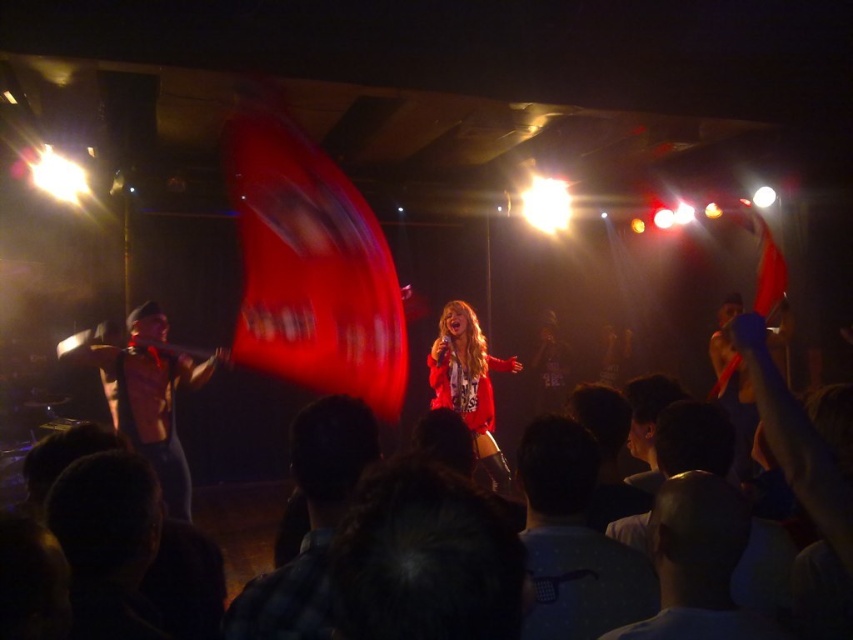
You are standing at the center of the stage and want to hand a microphone stand to the person wearing the dark gray cotton shirt at lower right. In which direction should you move to reach them?

The dark gray cotton shirt at lower right is located at point [573,540], so you should move towards the lower right direction to reach them.

You are a photographer trying to capture the best angle for the concert. You have two points marked on your viewfinder at coordinates point (543, 540) and point (151, 362). Which point is closer to your camera lens?

Point (543, 540) is closer to the camera lens than point (151, 362).

You are a stagehand trying to locate the shiny silver sword at left and the plaid shirt at center during a concert. According to the scene, which object is positioned to the right of the other?

The plaid shirt at center is to the right of the shiny silver sword at left.